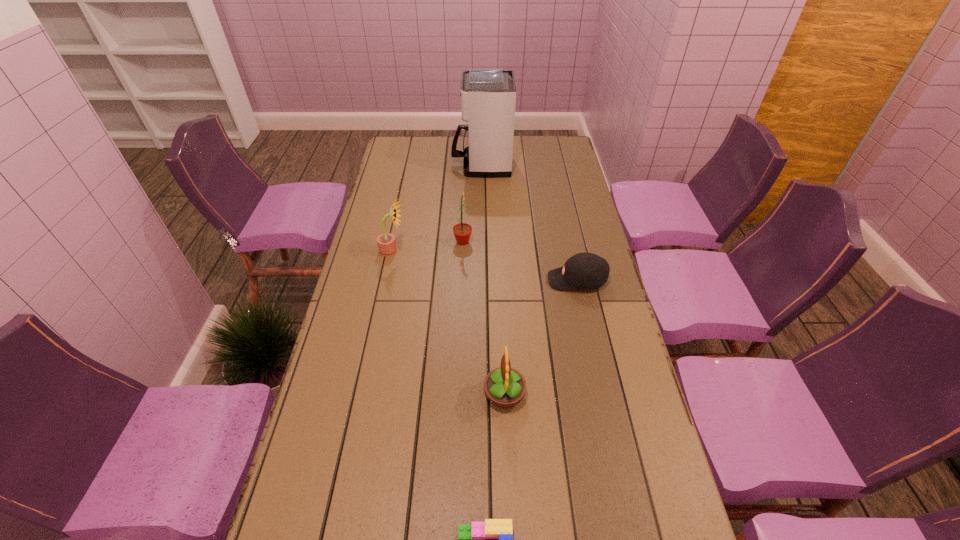
At what (x,y) coordinates should I click in order to perform the action: click on free region located 0.120m on the front panel of the farthest object. Please return your answer as a coordinate pair (x, y). The image size is (960, 540). Looking at the image, I should click on (425, 165).

Find the location of a particular element. This screenshot has height=540, width=960. vacant space situated 0.350m on the face of the second sunflower from left to right is located at coordinates (568, 242).

You are a GUI agent. You are given a task and a screenshot of the screen. Output one action in this format:
    pyautogui.click(x=<x>, y=<y>)
    Task: Click on the blank space located 0.220m on the face of the leftmost object
    The width and height of the screenshot is (960, 540).
    Given the screenshot: What is the action you would take?
    pyautogui.click(x=467, y=251)

At what (x,y) coordinates should I click in order to perform the action: click on vacant space located 0.340m on the face of the nearest sunflower. Please return your answer as a coordinate pair (x, y). The image size is (960, 540). Looking at the image, I should click on (356, 394).

Image resolution: width=960 pixels, height=540 pixels. Identify the location of free spot located 0.100m on the face of the nearest sunflower. (446, 394).

The height and width of the screenshot is (540, 960). Identify the location of free space located 0.130m on the face of the nearest sunflower. (435, 394).

The image size is (960, 540). In order to click on vacant space located 0.270m with a logo on the front of the rightmost object in this screenshot , I will do `click(467, 280)`.

Locate an element on the screen. The width and height of the screenshot is (960, 540). vacant region located 0.080m with a logo on the front of the rightmost object is located at coordinates (523, 280).

At what (x,y) coordinates should I click in order to perform the action: click on vacant region located 0.240m with a logo on the front of the rightmost object. Please return your answer as a coordinate pair (x, y). This screenshot has width=960, height=540. Looking at the image, I should click on [475, 280].

Locate an element on the screen. Image resolution: width=960 pixels, height=540 pixels. object situated at the far edge is located at coordinates (488, 96).